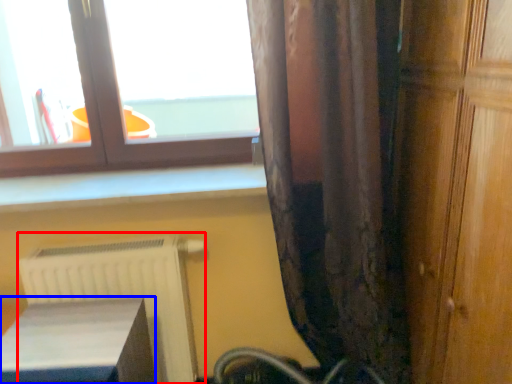
Question: Which object appears closest to the camera in this image, radiator (highlighted by a red box) or furniture (highlighted by a blue box)?

Choices:
 (A) radiator
 (B) furniture

Answer: (B)